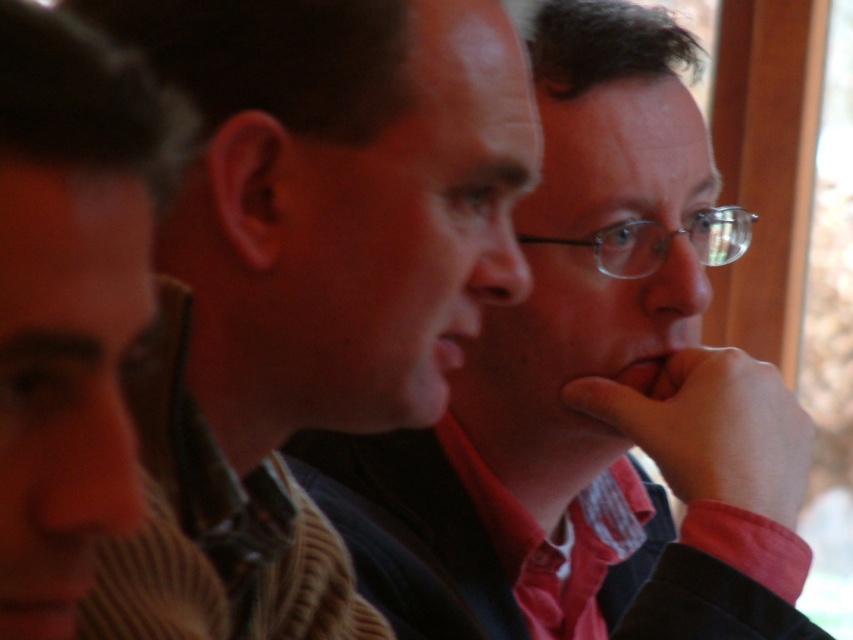
Is matte black shirt at center closer to the viewer compared to matte glass nose at center?

Yes.

Can you confirm if matte black shirt at center is shorter than matte glass nose at center?

In fact, matte black shirt at center may be taller than matte glass nose at center.

The width and height of the screenshot is (853, 640). Identify the location of matte black shirt at center. (332, 198).

The image size is (853, 640). In order to click on matte black shirt at center in this screenshot , I will do `click(332, 198)`.

Is point (6, 97) farther from viewer compared to point (662, 259)?

That is False.

Does brown striped sweater at left have a greater height compared to matte glass nose at center?

Correct, brown striped sweater at left is much taller as matte glass nose at center.

You are a GUI agent. You are given a task and a screenshot of the screen. Output one action in this format:
    pyautogui.click(x=<x>, y=<y>)
    Task: Click on the brown striped sweater at left
    
    Given the screenshot: What is the action you would take?
    point(70,300)

Where is `brown striped sweater at left`? Image resolution: width=853 pixels, height=640 pixels. brown striped sweater at left is located at coordinates (70, 300).

Between matte black shirt at center and matte skin nose at center, which one has less height?

With less height is matte skin nose at center.

Where is `matte black shirt at center`? This screenshot has width=853, height=640. matte black shirt at center is located at coordinates (332, 198).